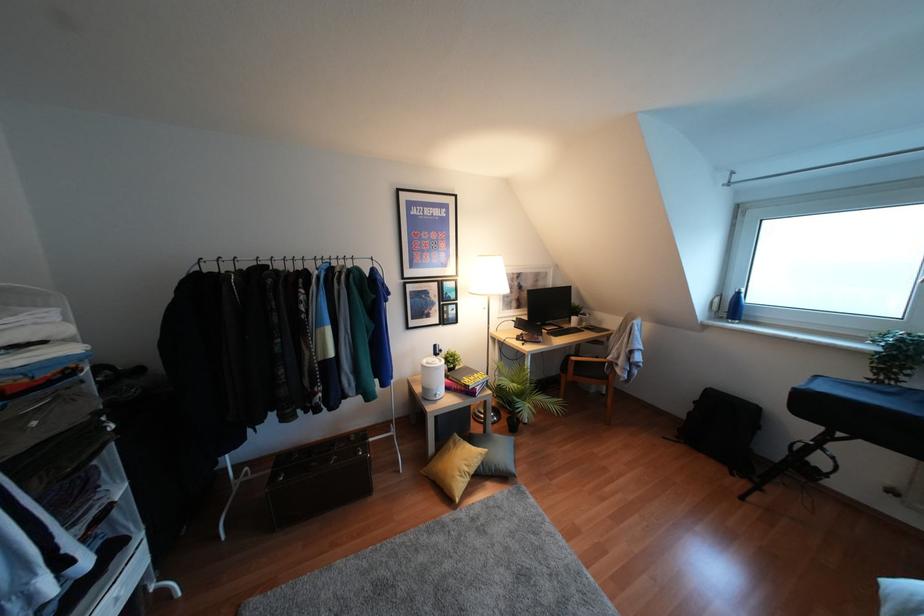
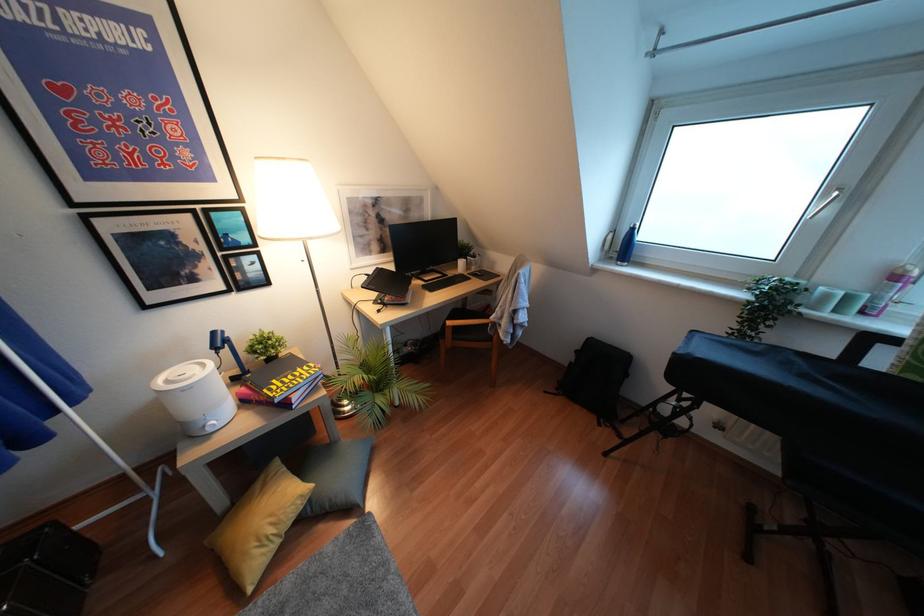
The point at (481, 463) is marked in the first image. Where is the corresponding point in the second image?

(310, 500)